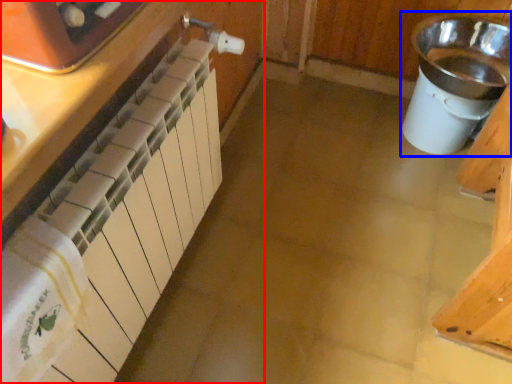
Question: Which object is closer to the camera taking this photo, cabinetry (highlighted by a red box) or sink (highlighted by a blue box)?

Choices:
 (A) cabinetry
 (B) sink

Answer: (A)